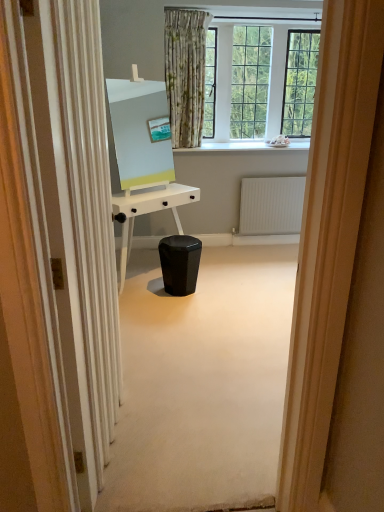
At what (x,y) coordinates should I click in order to perform the action: click on black glossy music stool at center. Please return your answer as a coordinate pair (x, y). Looking at the image, I should click on (180, 263).

Measure the distance between black glossy music stool at center and camera.

black glossy music stool at center is 3.30 meters from camera.

This screenshot has height=512, width=384. What do you see at coordinates (148, 212) in the screenshot? I see `white glossy desk at center` at bounding box center [148, 212].

This screenshot has width=384, height=512. Describe the element at coordinates (137, 134) in the screenshot. I see `matte white easel at center` at that location.

Where is `black glossy music stool at center`? This screenshot has width=384, height=512. black glossy music stool at center is located at coordinates (180, 263).

In the scene shown: Which object is positioned more to the left, white textured radiator at center or matte white easel at center?

Positioned to the left is matte white easel at center.

From a real-world perspective, is white textured radiator at center beneath matte white easel at center?

Yes, from a real-world perspective, white textured radiator at center is beneath matte white easel at center.

Considering the relative sizes of white textured radiator at center and matte white easel at center in the image provided, is white textured radiator at center thinner than matte white easel at center?

Yes.

Which is farther, (297, 204) or (164, 264)?

The point (297, 204) is behind.

Is white textured radiator at center oriented towards black glossy music stool at center?

No, white textured radiator at center is not aimed at black glossy music stool at center.

Can you confirm if white textured radiator at center is positioned to the left of black glossy music stool at center?

No.

Is white textured radiator at center not within black glossy music stool at center?

white textured radiator at center lies outside black glossy music stool at center's area.

Which object is thinner, matte white easel at center or white textured radiator at center?

white textured radiator at center is thinner.

Is matte white easel at center inside or outside of white textured radiator at center?

matte white easel at center is located beyond the bounds of white textured radiator at center.

Can you confirm if matte white easel at center is shorter than white textured radiator at center?

No, matte white easel at center is not shorter than white textured radiator at center.

Between matte white easel at center and white textured radiator at center, which one has larger size?

matte white easel at center is bigger.

Is white glossy screen door at left aimed at black glossy music stool at center?

No, white glossy screen door at left does not turn towards black glossy music stool at center.

Between point (77, 413) and point (196, 248), which one is positioned in front?

Positioned in front is point (77, 413).

How much distance is there between white glossy screen door at left and black glossy music stool at center?

A distance of 6.49 feet exists between white glossy screen door at left and black glossy music stool at center.

Is white glossy screen door at left positioned before black glossy music stool at center?

Yes, it is.

From a real-world perspective, is matte white easel at center physically located above or below white glossy desk at center?

Clearly, from a real-world perspective, matte white easel at center is above white glossy desk at center.

Is matte white easel at center not within white glossy desk at center?

Yes, matte white easel at center is outside of white glossy desk at center.

Does matte white easel at center have a larger size compared to white glossy desk at center?

Incorrect, matte white easel at center is not larger than white glossy desk at center.

Does matte white easel at center have a lesser height compared to white glossy desk at center?

In fact, matte white easel at center may be taller than white glossy desk at center.

Is white glossy desk at center taller or shorter than black glossy music stool at center?

Clearly, white glossy desk at center is taller compared to black glossy music stool at center.

Does white glossy desk at center turn towards black glossy music stool at center?

Yes, white glossy desk at center is facing black glossy music stool at center.

Is white glossy desk at center with black glossy music stool at center?

white glossy desk at center is not next to black glossy music stool at center, and they're not touching.

Does white glossy desk at center appear on the left side of black glossy music stool at center?

Yes.

Who is bigger, white textured radiator at center or white glossy desk at center?

white glossy desk at center is bigger.

Can you confirm if white textured radiator at center is shorter than white glossy desk at center?

Indeed, white textured radiator at center has a lesser height compared to white glossy desk at center.

Is white textured radiator at center in contact with white glossy desk at center?

No, white textured radiator at center is not with white glossy desk at center.

You are a GUI agent. You are given a task and a screenshot of the screen. Output one action in this format:
    pyautogui.click(x=<x>, y=<y>)
    Task: Click on the radiator behind the white glossy desk at center
    This screenshot has height=512, width=384.
    Given the screenshot: What is the action you would take?
    pyautogui.click(x=271, y=205)

Where is `computer monitor that is on the left side of white textured radiator at center`? Image resolution: width=384 pixels, height=512 pixels. computer monitor that is on the left side of white textured radiator at center is located at coordinates (137, 134).

Where is `music stool in front of the white textured radiator at center`? music stool in front of the white textured radiator at center is located at coordinates (180, 263).

When comparing their distances from white glossy desk at center, does matte white easel at center or white glossy screen door at left seem closer?

matte white easel at center.

Which object lies further to the anchor point white glossy desk at center, white glossy screen door at left or black glossy music stool at center?

The object further to white glossy desk at center is white glossy screen door at left.

Estimate the real-world distances between objects in this image. Which object is further from white textured radiator at center, black glossy music stool at center or white glossy desk at center?

black glossy music stool at center.

Considering their positions, is black glossy music stool at center positioned further to white glossy desk at center than matte white easel at center?

Among the two, black glossy music stool at center is located further to white glossy desk at center.

When comparing their distances from black glossy music stool at center, does white glossy screen door at left or white textured radiator at center seem closer?

The object closer to black glossy music stool at center is white textured radiator at center.

Which object lies nearer to the anchor point white glossy screen door at left, black glossy music stool at center or white glossy desk at center?

white glossy desk at center.

From the picture: Estimate the real-world distances between objects in this image. Which object is further from white glossy desk at center, white textured radiator at center or white glossy screen door at left?

The object further to white glossy desk at center is white glossy screen door at left.

Which object lies further to the anchor point white glossy desk at center, white textured radiator at center or matte white easel at center?

white textured radiator at center.

Find the location of a particular element. Image resolution: width=384 pixels, height=512 pixels. music stool positioned between matte white easel at center and white textured radiator at center from near to far is located at coordinates (180, 263).

Find the location of a particular element. Image resolution: width=384 pixels, height=512 pixels. desk between matte white easel at center and black glossy music stool at center vertically is located at coordinates (148, 212).

This screenshot has width=384, height=512. What are the coordinates of `music stool between white glossy screen door at left and white textured radiator at center from front to back` in the screenshot? It's located at (180, 263).

This screenshot has width=384, height=512. Find the location of `computer monitor positioned between white glossy screen door at left and white glossy desk at center from near to far`. computer monitor positioned between white glossy screen door at left and white glossy desk at center from near to far is located at coordinates (137, 134).